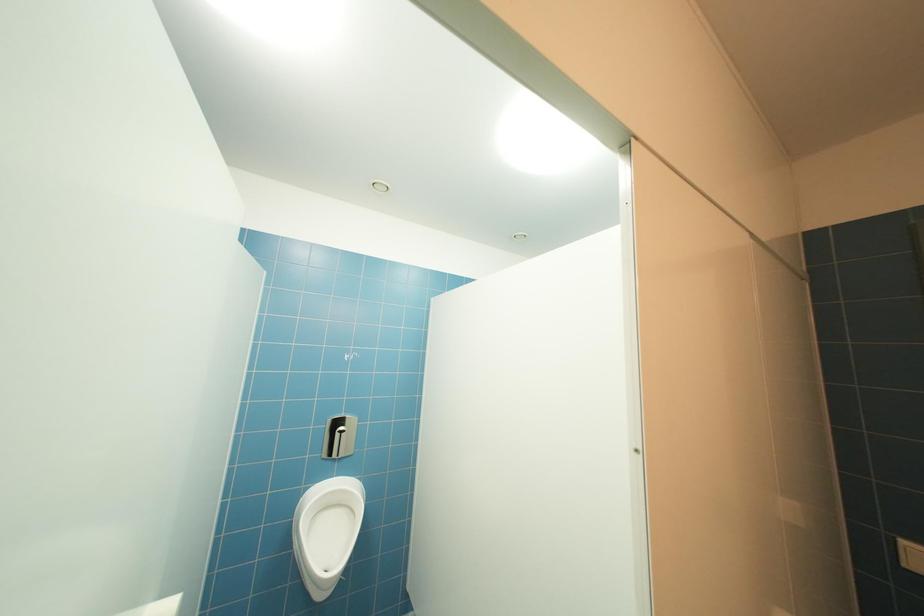
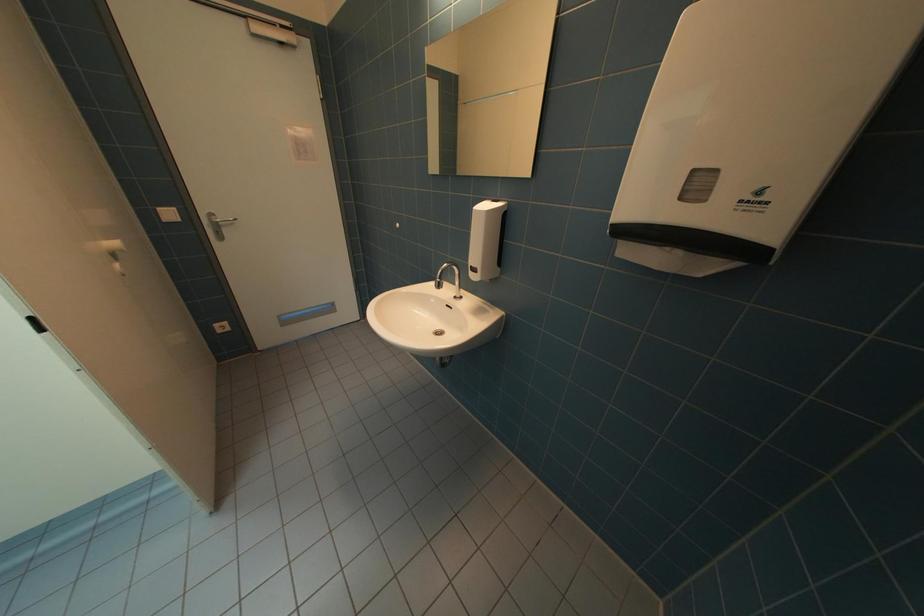
The images are taken continuously from a first-person perspective. In which direction is your viewpoint rotating?

The rotation direction of the camera is right-down.